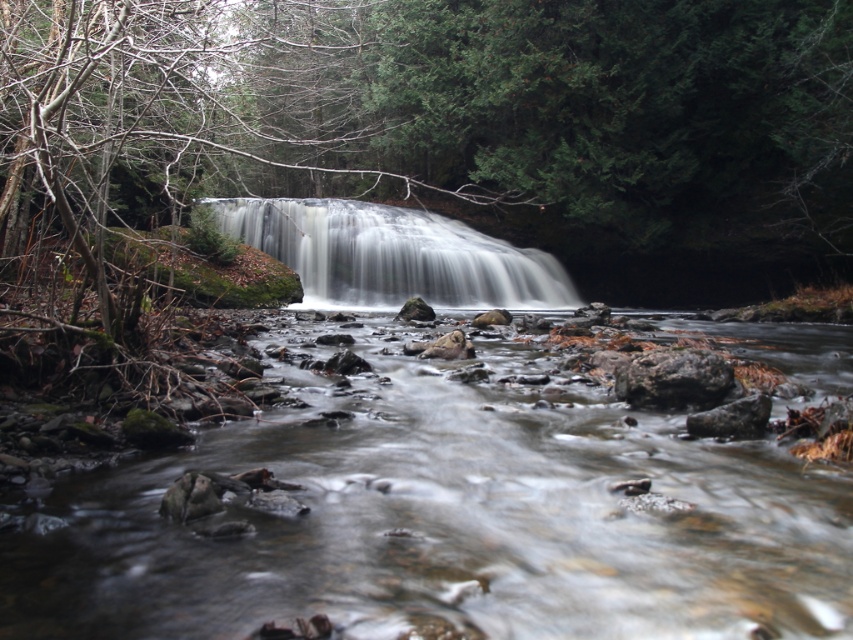
Question: Is clear water at center smaller than rough textured rock at center?

Choices:
 (A) yes
 (B) no

Answer: (B)

Question: Which object appears farthest from the camera in this image?

Choices:
 (A) rough textured rock at center
 (B) clear water at center

Answer: (A)

Question: Can you confirm if white smooth waterfall at center is wider than rough textured rock at center?

Choices:
 (A) yes
 (B) no

Answer: (A)

Question: Which of the following is the farthest from the observer?

Choices:
 (A) rough textured rock at center
 (B) clear water at center
 (C) white smooth waterfall at center

Answer: (C)

Question: Which of the following is the closest to the observer?

Choices:
 (A) (531, 477)
 (B) (347, 291)
 (C) (729, 387)

Answer: (A)

Question: Is clear water at center above rough textured rock at center?

Choices:
 (A) no
 (B) yes

Answer: (A)